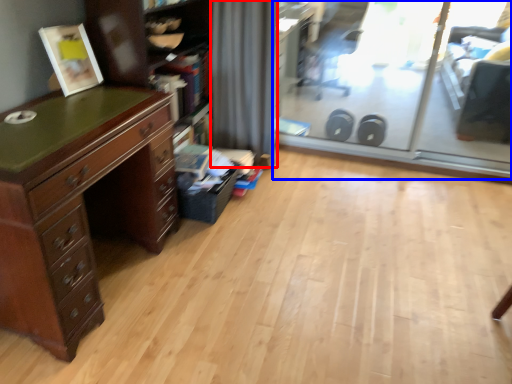
Question: Among these objects, which one is farthest to the camera, curtain (highlighted by a red box) or screen door (highlighted by a blue box)?

Choices:
 (A) curtain
 (B) screen door

Answer: (A)